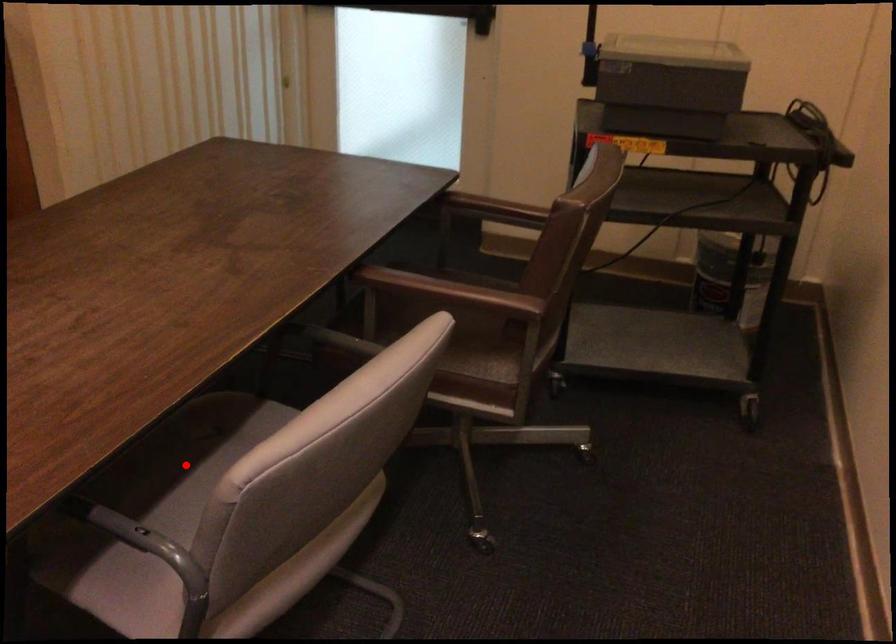
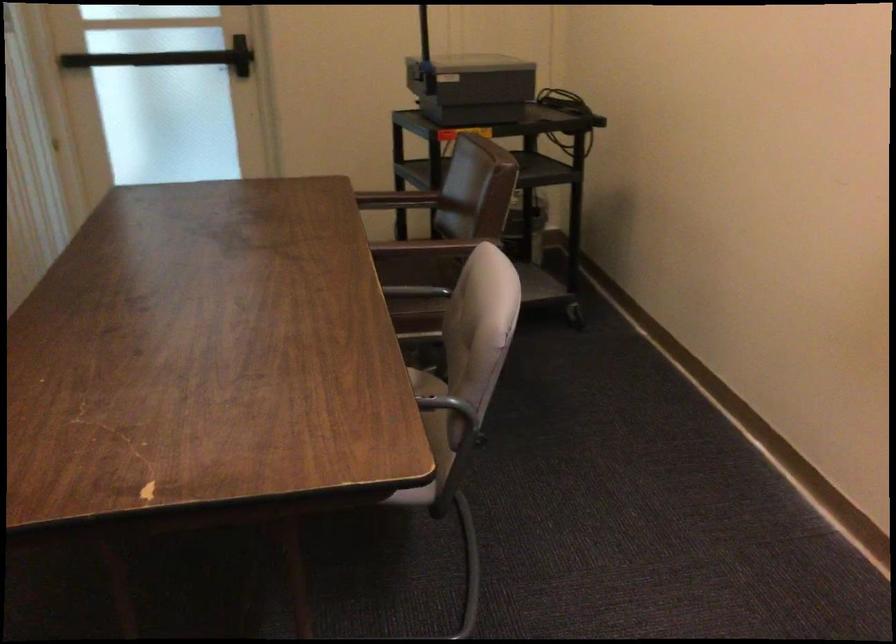
Question: I am providing you with two images of the same scene from different viewpoints. A red point is marked on the first image. At the location where the point appears in image 1, is it still visible in image 2?

Choices:
 (A) Yes
 (B) No

Answer: (B)